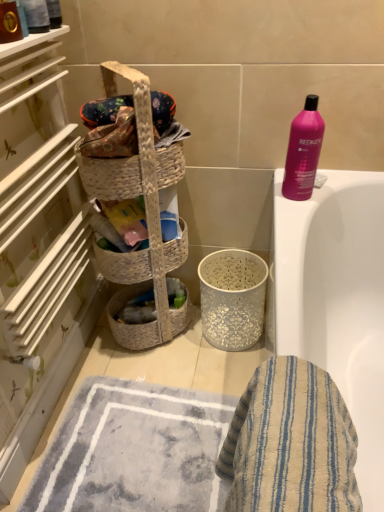
Question: Considering the relative positions of woven beige laundry basket at left and gray textured bath mat at lower center in the image provided, is woven beige laundry basket at left to the left or to the right of gray textured bath mat at lower center?

Choices:
 (A) left
 (B) right

Answer: (B)

Question: Is woven beige laundry basket at left spatially inside gray textured bath mat at lower center, or outside of it?

Choices:
 (A) outside
 (B) inside

Answer: (A)

Question: Considering the real-world distances, which object is closest to the pink glossy shampoo at upper right?

Choices:
 (A) woven natural picnic basket at center
 (B) blue striped cloth at lower right
 (C) woven basket at left
 (D) woven beige laundry basket at left
 (E) gray textured bath mat at lower center

Answer: (A)

Question: Considering the real-world distances, which object is closest to the pink glossy shampoo at upper right?

Choices:
 (A) blue striped cloth at lower right
 (B) gray textured bath mat at lower center
 (C) woven beige laundry basket at left
 (D) woven natural picnic basket at center
 (E) woven basket at left

Answer: (D)